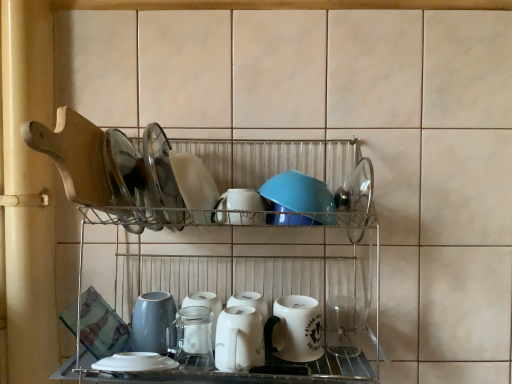
Question: Considering the relative sizes of metallic wire rack at center and white glossy mug at lower center in the image provided, is metallic wire rack at center shorter than white glossy mug at lower center?

Choices:
 (A) no
 (B) yes

Answer: (A)

Question: Is metallic wire rack at center outside white glossy mug at lower center?

Choices:
 (A) yes
 (B) no

Answer: (A)

Question: From a real-world perspective, is metallic wire rack at center physically above white glossy mug at lower center?

Choices:
 (A) yes
 (B) no

Answer: (A)

Question: From the image's perspective, is metallic wire rack at center below white glossy mug at lower center?

Choices:
 (A) no
 (B) yes

Answer: (A)

Question: From a real-world perspective, is metallic wire rack at center physically below white glossy mug at lower center?

Choices:
 (A) yes
 (B) no

Answer: (B)

Question: From the image's perspective, is metallic wire rack at center located above or below white glossy mug at lower center?

Choices:
 (A) below
 (B) above

Answer: (B)

Question: Considering the positions of metallic wire rack at center and white glossy mug at lower center in the image, is metallic wire rack at center bigger or smaller than white glossy mug at lower center?

Choices:
 (A) big
 (B) small

Answer: (A)

Question: Does point (300, 370) appear closer or farther from the camera than point (316, 352)?

Choices:
 (A) closer
 (B) farther

Answer: (A)

Question: Is metallic wire rack at center wider or thinner than white glossy mug at lower center?

Choices:
 (A) wide
 (B) thin

Answer: (A)

Question: Do you think metallic wire rack at center is within white glossy plate at center, arranged as the fourth tableware when ordered from the bottom, or outside of it?

Choices:
 (A) inside
 (B) outside

Answer: (B)

Question: Considering their positions, is metallic wire rack at center located in front of or behind white glossy plate at center, which appears as the first tableware when viewed from the top?

Choices:
 (A) front
 (B) behind

Answer: (A)

Question: In terms of width, does metallic wire rack at center look wider or thinner when compared to white glossy plate at center, which appears as the first tableware when viewed from the top?

Choices:
 (A) thin
 (B) wide

Answer: (B)

Question: Is metallic wire rack at center taller or shorter than white glossy plate at center, which appears as the first tableware when viewed from the top?

Choices:
 (A) short
 (B) tall

Answer: (B)

Question: From a real-world perspective, is white glossy kettle at center, the fourth tableware positioned from the top, physically located above or below white glossy plate at center, arranged as the fourth tableware when ordered from the bottom?

Choices:
 (A) above
 (B) below

Answer: (B)

Question: Is white glossy kettle at center, marked as the 1th tableware in a bottom-to-top arrangement, bigger or smaller than white glossy plate at center, arranged as the fourth tableware when ordered from the bottom?

Choices:
 (A) big
 (B) small

Answer: (B)